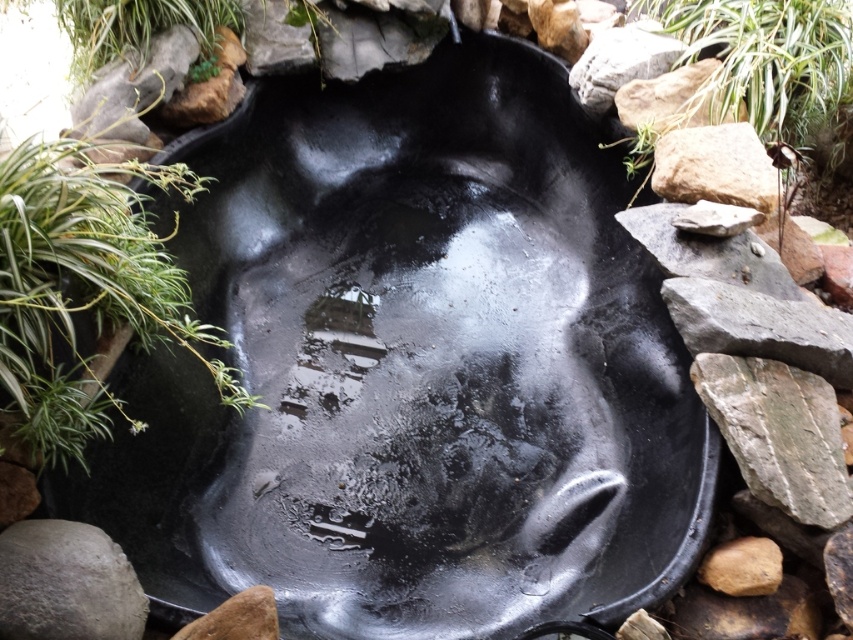
Question: Estimate the real-world distances between objects in this image. Which object is closer to the green leafy plant at center?

Choices:
 (A) green leafy plant at upper right
 (B) gray rough stone at right
 (C) smooth gray rock at upper right

Answer: (B)

Question: Does green leafy plant at center have a smaller size compared to smooth gray rock at upper right?

Choices:
 (A) yes
 (B) no

Answer: (B)

Question: Does gray rough stone at right appear over gray rough stone at lower left?

Choices:
 (A) yes
 (B) no

Answer: (A)

Question: Which point is farther to the camera?

Choices:
 (A) gray rough stone at lower left
 (B) gray rough stone at right

Answer: (B)

Question: Where is green leafy plant at center located in relation to green leafy plant at upper right in the image?

Choices:
 (A) right
 (B) left

Answer: (B)

Question: Which object appears farthest from the camera in this image?

Choices:
 (A) gray rough stone at lower left
 (B) green leafy plant at center
 (C) green leafy plant at upper right

Answer: (C)